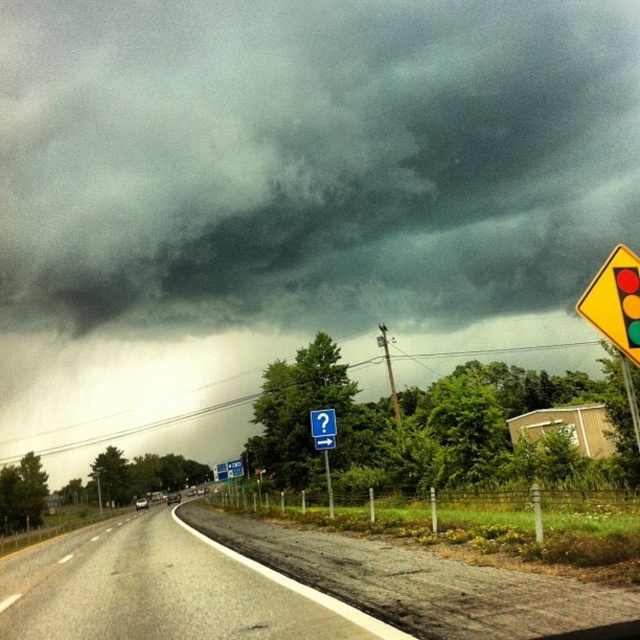
You are driving a car and see the asphalt road at lower left and the brushed metal signpost at center. Which object is closer to the left side of your view?

The asphalt road at lower left is closer to the left side of your view because it is positioned to the left of the brushed metal signpost at center.

You are driving a car that is 4.5 meters long. You see the yellow plastic traffic light at right ahead on the road. Can your car completely pass the traffic light before reaching it?

The distance between you and the yellow plastic traffic light at right is 7.06 meters. Since your car is 4.5 meters long, you can completely pass the traffic light before reaching it as the distance is greater than the car length.

You are driving a car and see the asphalt road at lower left and the yellow plastic traffic light at right. Which object is closer to you?

The asphalt road at lower left is closer because it is in front of the yellow plastic traffic light at right.